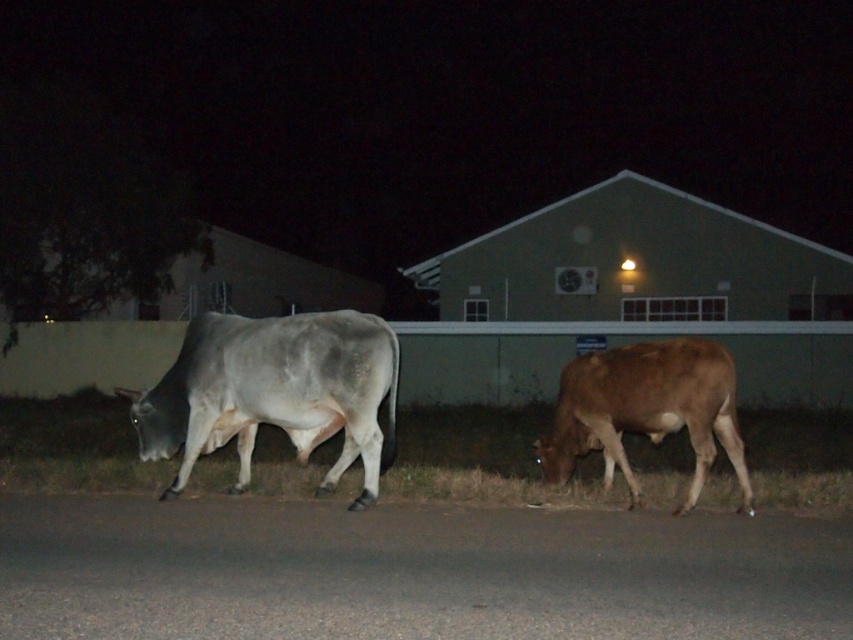
Question: Does green grass at lower center have a smaller size compared to gray matte cow at center?

Choices:
 (A) yes
 (B) no

Answer: (B)

Question: Which of these objects is positioned closest to the green grass at lower center?

Choices:
 (A) brown matte bull at lower right
 (B) gray matte cow at center

Answer: (B)

Question: Which of the following is the closest to the observer?

Choices:
 (A) gray matte cow at center
 (B) green grass at lower center
 (C) brown matte bull at lower right

Answer: (C)

Question: Among these objects, which one is nearest to the camera?

Choices:
 (A) green grass at lower center
 (B) gray matte cow at center
 (C) brown matte bull at lower right

Answer: (C)

Question: Can you confirm if green grass at lower center is wider than brown matte bull at lower right?

Choices:
 (A) no
 (B) yes

Answer: (B)

Question: Can you confirm if green grass at lower center is bigger than gray matte cow at center?

Choices:
 (A) no
 (B) yes

Answer: (B)